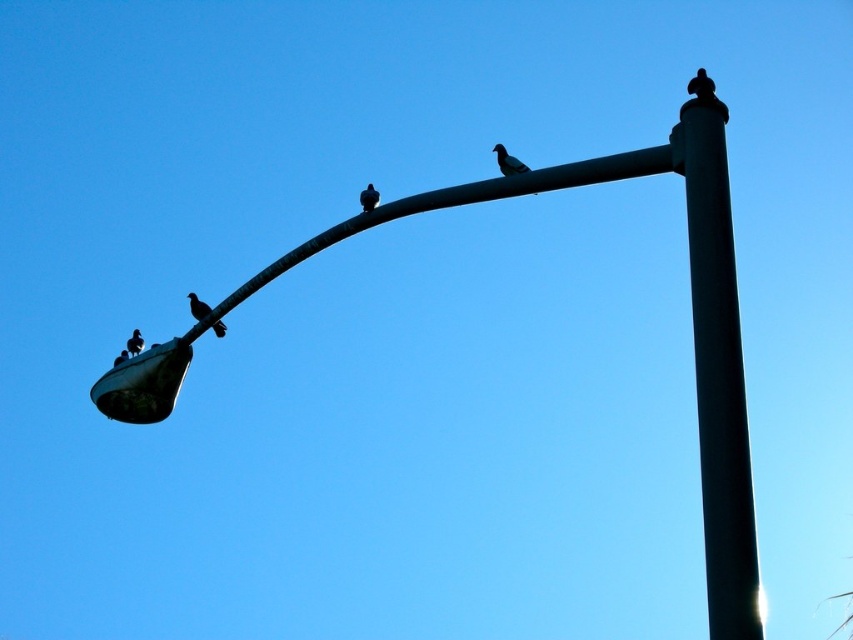
Question: Which object is closer to the camera taking this photo?

Choices:
 (A) silvery metallic bird at upper center
 (B) silvery metallic bird at left
 (C) silhouette feathered bird at lower left
 (D) black metal pole at center-right

Answer: (D)

Question: Which of the following is the closest to the observer?

Choices:
 (A) (141, 339)
 (B) (734, 474)

Answer: (B)

Question: Observing the image, what is the correct spatial positioning of metallic pole at center in reference to silhouette feathered bird at lower left?

Choices:
 (A) right
 (B) left

Answer: (A)

Question: Can you confirm if black metal pole at center-right is positioned to the left of silvery metallic bird at left?

Choices:
 (A) no
 (B) yes

Answer: (A)

Question: Which point is farther to the camera?

Choices:
 (A) silvery metallic bird at left
 (B) silhouette feathered bird at lower left
 (C) black metal pole at center-right
 (D) black matte bird at upper center

Answer: (A)

Question: Can you confirm if black metal pole at center-right is positioned below silvery metallic bird at upper center?

Choices:
 (A) no
 (B) yes

Answer: (B)